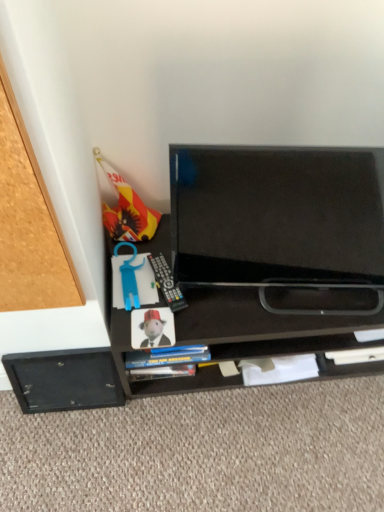
Question: Should I look upward or downward to see black matte tv at center?

Choices:
 (A) up
 (B) down

Answer: (B)

Question: Is black glossy tv at center completely or partially outside of matte paper book at center?

Choices:
 (A) no
 (B) yes

Answer: (B)

Question: Does black glossy tv at center have a lesser width compared to matte paper book at center?

Choices:
 (A) no
 (B) yes

Answer: (A)

Question: Is black glossy tv at center shorter than matte paper book at center?

Choices:
 (A) yes
 (B) no

Answer: (B)

Question: Would you consider black glossy tv at center to be distant from matte paper book at center?

Choices:
 (A) no
 (B) yes

Answer: (A)

Question: Is black glossy tv at center facing towards matte paper book at center?

Choices:
 (A) no
 (B) yes

Answer: (A)

Question: Does black glossy tv at center have a greater height compared to matte paper book at center?

Choices:
 (A) no
 (B) yes

Answer: (B)

Question: Would you say black matte drawer at lower left is part of matte paper book at center's contents?

Choices:
 (A) yes
 (B) no

Answer: (B)

Question: Would you say matte paper book at center is a long distance from black matte drawer at lower left?

Choices:
 (A) no
 (B) yes

Answer: (A)

Question: From the image's perspective, is matte paper book at center on top of black matte drawer at lower left?

Choices:
 (A) no
 (B) yes

Answer: (B)

Question: Considering the relative positions of matte paper book at center and black matte drawer at lower left in the image provided, is matte paper book at center in front of black matte drawer at lower left?

Choices:
 (A) no
 (B) yes

Answer: (B)

Question: Does matte paper book at center have a greater width compared to black matte drawer at lower left?

Choices:
 (A) yes
 (B) no

Answer: (A)

Question: Is matte paper book at center to the left of black matte drawer at lower left from the viewer's perspective?

Choices:
 (A) yes
 (B) no

Answer: (B)

Question: Considering the relative sizes of matte paper book at center and black glossy tv at center in the image provided, is matte paper book at center wider than black glossy tv at center?

Choices:
 (A) no
 (B) yes

Answer: (A)